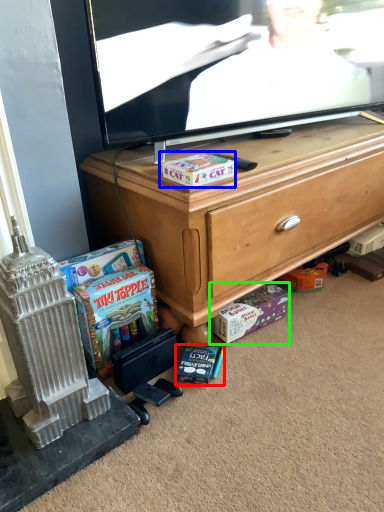
Question: Which object is positioned farthest from book (highlighted by a red box)? Select from cash (highlighted by a blue box) and cash (highlighted by a green box).

Choices:
 (A) cash
 (B) cash

Answer: (A)